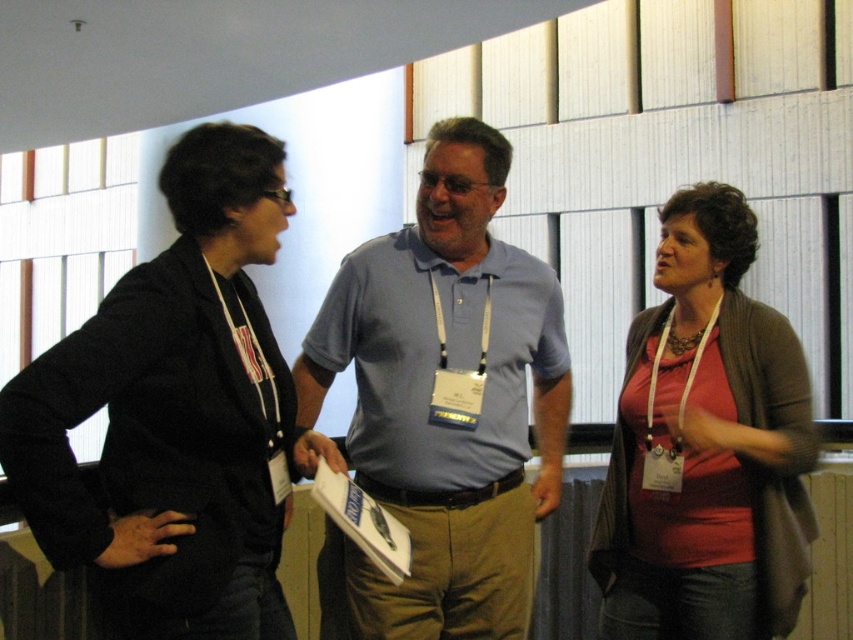
The image size is (853, 640). What do you see at coordinates (444, 403) in the screenshot?
I see `light blue cotton shirt at center` at bounding box center [444, 403].

Can you confirm if light blue cotton shirt at center is wider than matte red shirt at center?

Indeed, light blue cotton shirt at center has a greater width compared to matte red shirt at center.

Is point (368, 388) positioned after point (618, 417)?

No, (368, 388) is closer to viewer.

Where is `light blue cotton shirt at center`? This screenshot has width=853, height=640. light blue cotton shirt at center is located at coordinates (444, 403).

Consider the image. Between matte black blazer at left and light blue cotton shirt at center, which one has less height?

With less height is matte black blazer at left.

At what (x,y) coordinates should I click in order to perform the action: click on matte black blazer at left. Please return your answer as a coordinate pair (x, y). Image resolution: width=853 pixels, height=640 pixels. Looking at the image, I should click on pyautogui.click(x=177, y=413).

Is matte black blazer at left taller than matte red shirt at center?

In fact, matte black blazer at left may be shorter than matte red shirt at center.

Is point (90, 323) less distant than point (701, 467)?

Yes, it is in front of point (701, 467).

This screenshot has height=640, width=853. I want to click on matte black blazer at left, so click(x=177, y=413).